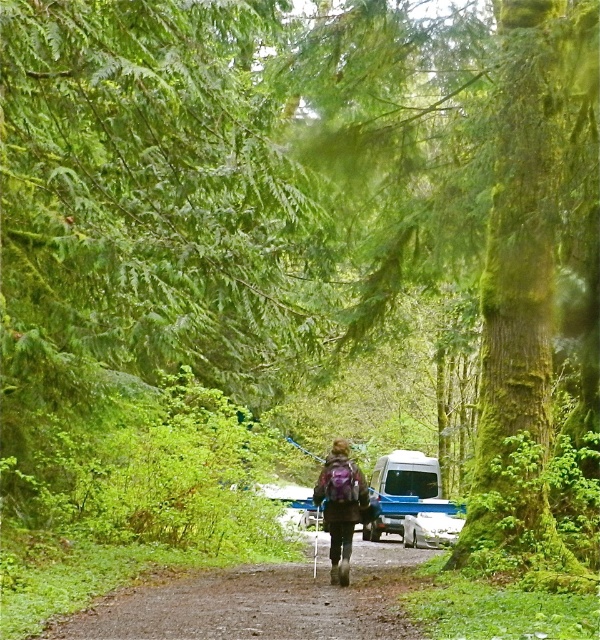
You are a hiker who just arrived at the forest and see the white matte camper van at center and the purple fabric backpack at center. Which object is taller?

The white matte camper van at center is much taller than the purple fabric backpack at center.

You are planning to park your white matte camper van at center in a parking spot that is only wide enough for the van if it is not wider than the purple fabric backpack at center. Can you safely park there?

The white matte camper van at center might be wider than the purple fabric backpack at center, so there is uncertainty about whether it will fit. You should measure or check the dimensions before deciding to park.